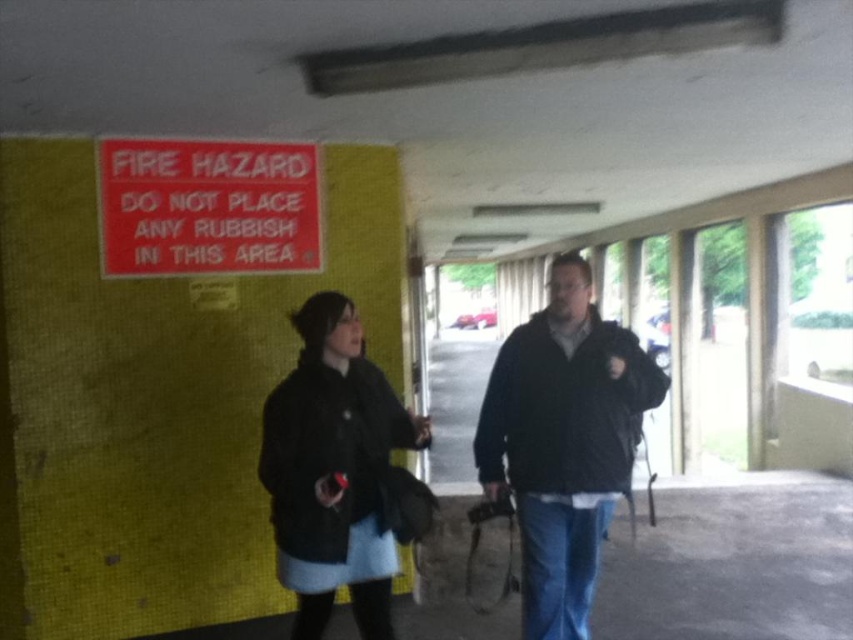
You are a security guard in the parking structure and need to check the red plastic sign at upper left. To reach it, you must pass by the black textured coat at center. Is the path clear to reach the sign?

The black textured coat at center is located below the red plastic sign at upper left, so the path to the sign should be clear as the coat is positioned underneath it, not blocking the way.

You are a security guard in the parking structure. You need to ensure that the black textured coat at center and the red plastic sign at upper left are visible to anyone entering the corridor. Which object should you position closer to the entrance to ensure visibility?

The red plastic sign at upper left should be positioned closer to the entrance because it is wider than the black textured coat at center, making it more noticeable from a distance.